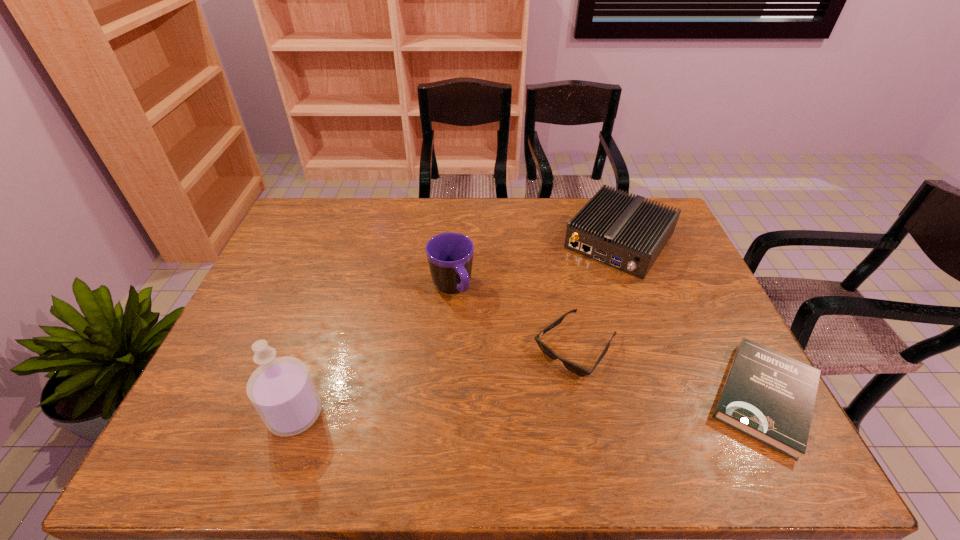
You are a GUI agent. You are given a task and a screenshot of the screen. Output one action in this format:
    pyautogui.click(x=<x>, y=<y>)
    Task: Click on the vacant region located with the handle on the side of the mug
    This screenshot has height=540, width=960.
    Given the screenshot: What is the action you would take?
    pyautogui.click(x=484, y=349)

Locate an element on the screen. vacant space situated with the handle on the side of the mug is located at coordinates (504, 386).

The width and height of the screenshot is (960, 540). What are the coordinates of `vacant space located 0.160m on the front-facing side of the second shortest object` in the screenshot? It's located at (510, 419).

The image size is (960, 540). I want to click on vacant space located 0.120m on the front-facing side of the second shortest object, so click(520, 408).

Locate an element on the screen. vacant area situated 0.070m on the front-facing side of the second shortest object is located at coordinates (534, 394).

The image size is (960, 540). Identify the location of vacant space located on the back panel of the third shortest object. (575, 299).

Where is `free space located 0.160m on the back panel of the third shortest object`? free space located 0.160m on the back panel of the third shortest object is located at coordinates (572, 302).

The height and width of the screenshot is (540, 960). What are the coordinates of `free region located 0.400m on the back panel of the third shortest object` in the screenshot? It's located at (529, 358).

Locate an element on the screen. This screenshot has height=540, width=960. object that is at the far edge is located at coordinates (623, 231).

Where is `perfume present at the near edge`? perfume present at the near edge is located at coordinates (281, 389).